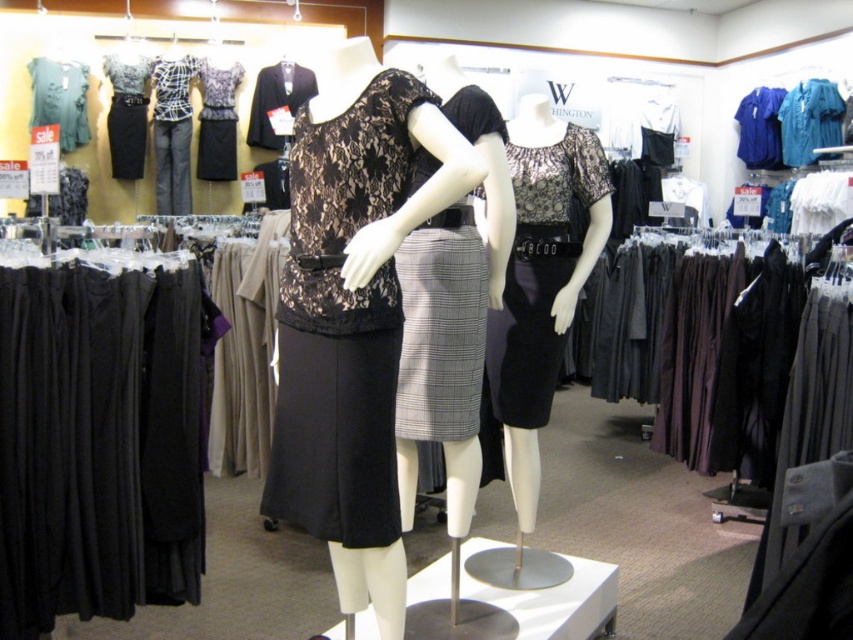
Question: Does black textured dress at center have a smaller size compared to teal satin blouse at upper right?

Choices:
 (A) no
 (B) yes

Answer: (A)

Question: Which point is closer to the camera taking this photo?

Choices:
 (A) (132, 164)
 (B) (175, 92)

Answer: (B)

Question: Is the position of lace fabric dress at center less distant than that of teal satin blouse at upper right?

Choices:
 (A) yes
 (B) no

Answer: (A)

Question: Does plaid fabric blouse at center have a larger size compared to black lace dress at upper left?

Choices:
 (A) yes
 (B) no

Answer: (A)

Question: Which object appears farthest from the camera in this image?

Choices:
 (A) gray wool skirt at center
 (B) plaid fabric blouse at center
 (C) lace fabric blouse at upper center

Answer: (C)

Question: Which of the following is the closest to the observer?

Choices:
 (A) black lace dress at upper left
 (B) lace fabric dress at center
 (C) gray wool skirt at center
 (D) lace fabric blouse at upper center

Answer: (B)